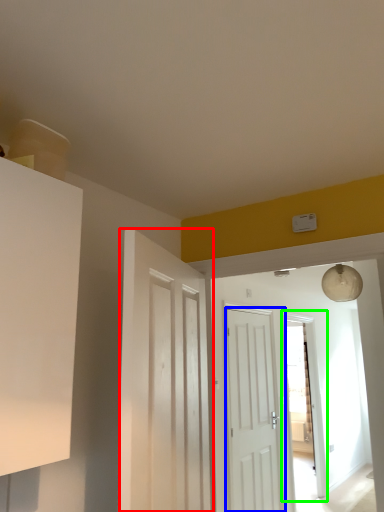
Question: Considering the real-world distances, which object is farthest from door (highlighted by a red box)? door (highlighted by a blue box) or glass door (highlighted by a green box)?

Choices:
 (A) door
 (B) glass door

Answer: (B)